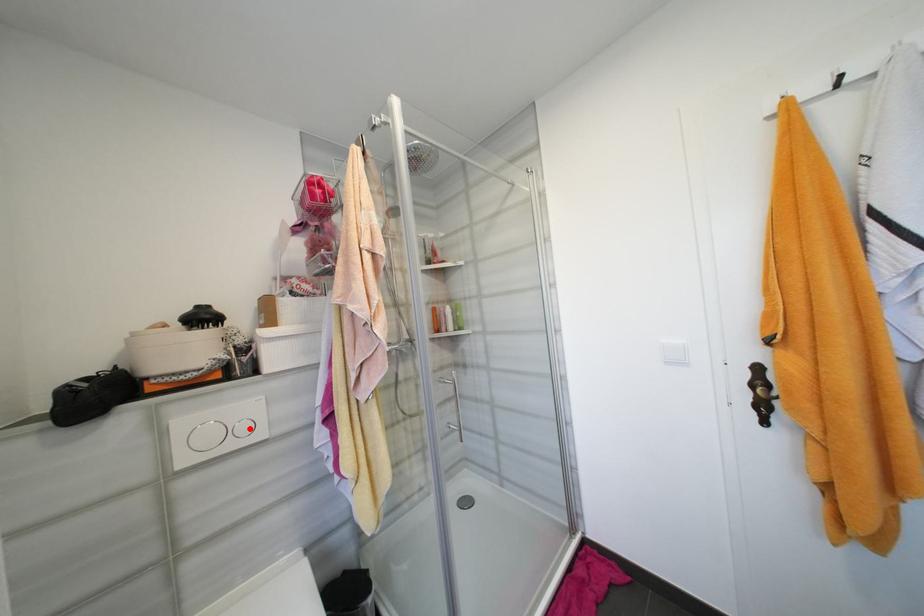
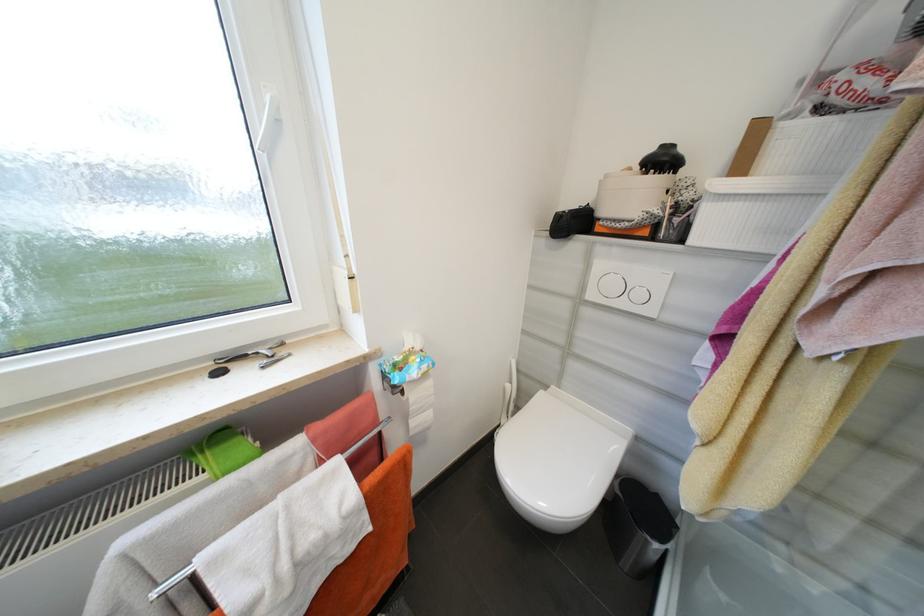
Locate, in the second image, the point that corresponds to the highlighted location in the first image.

(646, 296)